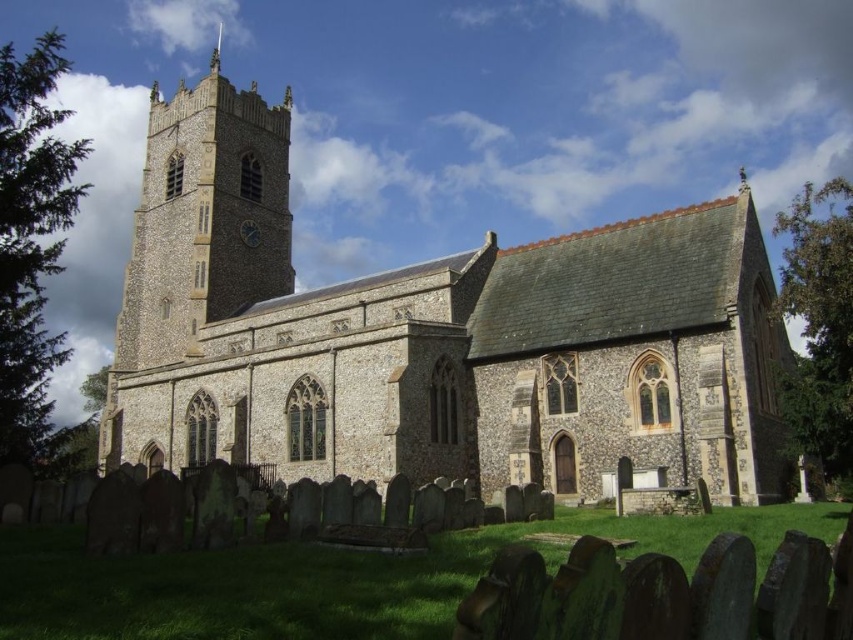
You are standing at the entrance of the church and looking up at the tower. Which object, the dark brown wooden clock at upper center or the silver metallic spire at upper center, is located higher up?

The silver metallic spire at upper center is located higher up because the dark brown wooden clock at upper center is positioned under it.

You are standing at the base of the stone church at center and want to place a 100 foot long decorative banner that stretches to the silver metallic spire at upper center. Will the banner be long enough to reach the spire?

The stone church at center and silver metallic spire at upper center are 151.95 feet apart. The banner is only 100 feet long, so it will not be long enough to reach the spire.